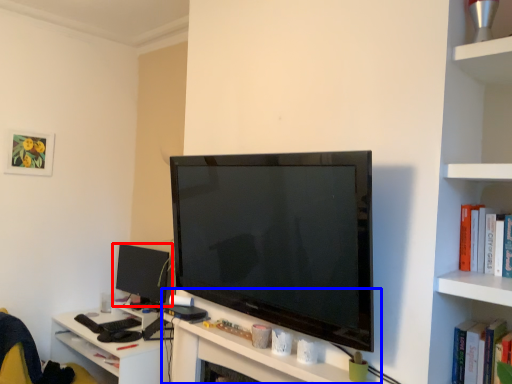
Question: Which point is further to the camera, computer monitor (highlighted by a red box) or computer desk (highlighted by a blue box)?

Choices:
 (A) computer monitor
 (B) computer desk

Answer: (A)